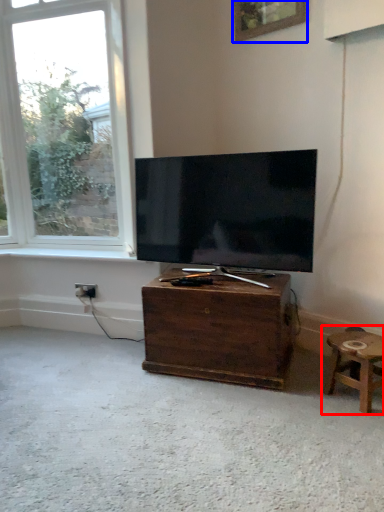
Question: Among these objects, which one is nearest to the camera, stool (highlighted by a red box) or picture frame (highlighted by a blue box)?

Choices:
 (A) stool
 (B) picture frame

Answer: (A)